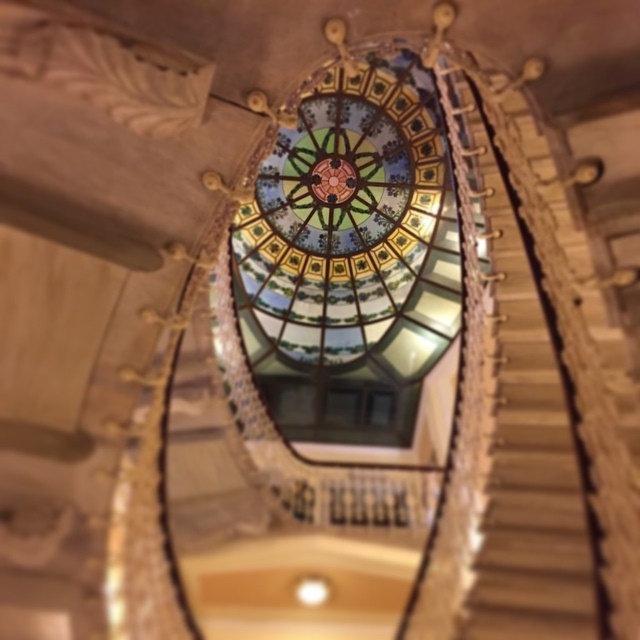
Question: Is stained glass dome at center closer to camera compared to wooden at center?

Choices:
 (A) yes
 (B) no

Answer: (A)

Question: From the image, what is the correct spatial relationship of stained glass dome at center in relation to wooden at center?

Choices:
 (A) below
 (B) above

Answer: (B)

Question: In this image, where is stained glass dome at center located relative to wooden at center?

Choices:
 (A) left
 (B) right

Answer: (A)

Question: Which point is closer to the camera taking this photo?

Choices:
 (A) (324, 317)
 (B) (508, 401)

Answer: (B)